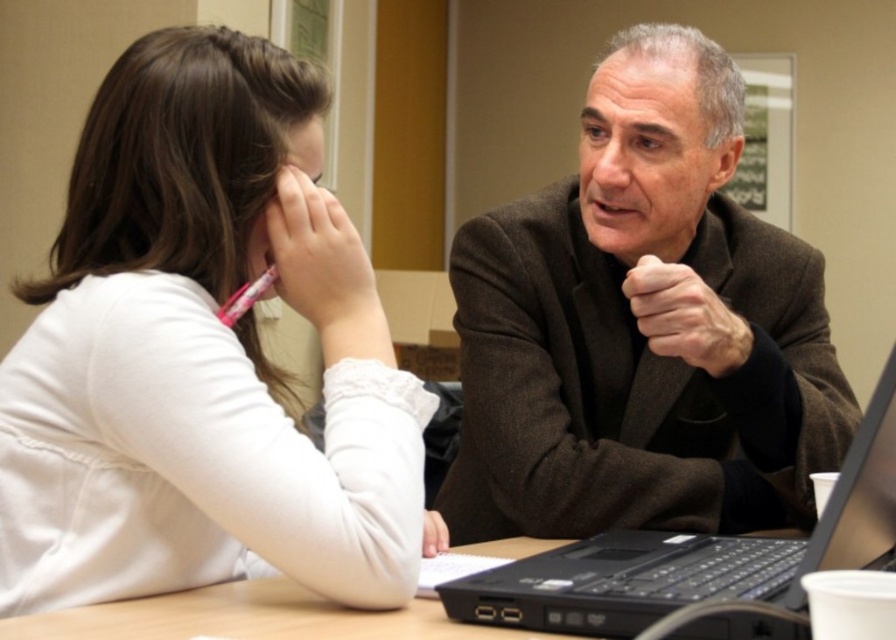
You are organizing a meeting in an office and need to place a brown woolen suit at center and a black plastic laptop at center on a table. According to the scene, which object should be placed to the right of the other?

The brown woolen suit at center should be placed to the right of the black plastic laptop at center because the brown woolen suit at center is positioned on the right side of black plastic laptop at center in the scene.

You are organizing a meeting in this office. You need to place a new document on the table so that it is between the brown woolen suit at center and the black plastic laptop at center. Is this possible given their positions?

The brown woolen suit at center is above the black plastic laptop at center, so placing a document between them would not be possible since the suit is positioned higher than the laptop on the table.

You are an office assistant who needs to determine the seating arrangement for a meeting. You see the white matte shirt at left and the white matte hand at lower center. Which object is positioned more to the left side of the scene?

The white matte shirt at left is positioned more to the left side of the scene than the white matte hand at lower center.